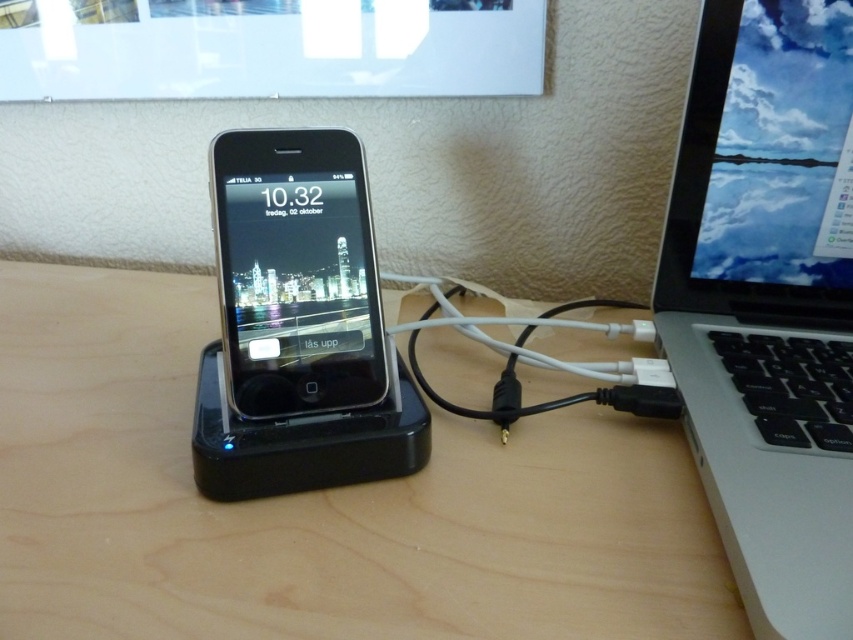
Is silver metallic laptop at right above black glossy ipod at center?

Actually, silver metallic laptop at right is below black glossy ipod at center.

Is point (759, 508) in front of point (239, 340)?

Yes.

Locate an element on the screen. The width and height of the screenshot is (853, 640). silver metallic laptop at right is located at coordinates (769, 301).

This screenshot has width=853, height=640. I want to click on wooden table at center, so click(x=317, y=502).

Does wooden table at center have a larger size compared to black glossy ipod at center?

Indeed, wooden table at center has a larger size compared to black glossy ipod at center.

Find the location of a particular element. wooden table at center is located at coordinates (317, 502).

Is silver metallic laptop at right bigger than black matte cable at center?

Yes, silver metallic laptop at right is bigger than black matte cable at center.

Does point (808, 449) come closer to viewer compared to point (509, 397)?

Yes, point (808, 449) is in front of point (509, 397).

Measure the distance between point (801,188) and camera.

22.14 inches

The image size is (853, 640). Find the location of `silver metallic laptop at right`. silver metallic laptop at right is located at coordinates (769, 301).